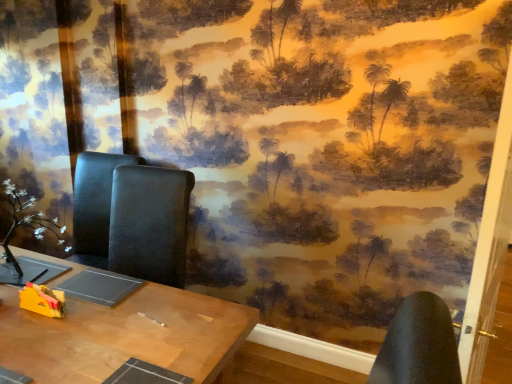
At what (x,y) coordinates should I click in order to perform the action: click on vacant area that is in front of yellow plastic toy at lower left. Please return your answer as a coordinate pair (x, y). The height and width of the screenshot is (384, 512). Looking at the image, I should click on (33, 336).